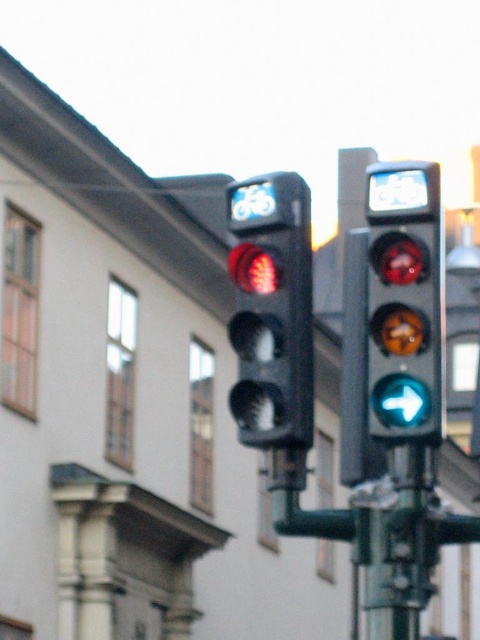
You are a cyclist approaching an intersection with two traffic lights. The scene includes a matte black traffic light at center and a matte glass traffic light at center. Which traffic light is shorter?

The matte black traffic light at center is shorter than the matte glass traffic light at center.

You are a cyclist approaching the intersection and need to choose between two traffic lights. The matte black traffic light at center and the matte glass traffic light at center. Which one is narrower in width?

The matte black traffic light at center is thinner than the matte glass traffic light at center, so the matte black traffic light at center is narrower in width.